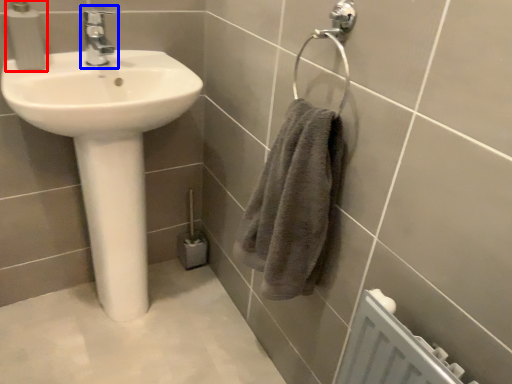
Question: Which object appears farthest to the camera in this image, soap dispenser (highlighted by a red box) or tap (highlighted by a blue box)?

Choices:
 (A) soap dispenser
 (B) tap

Answer: (B)